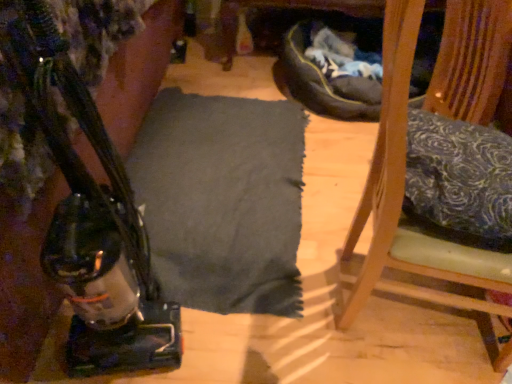
Question: Could wooden chair at right be considered to be inside blue floral fabric pillow at right?

Choices:
 (A) yes
 (B) no

Answer: (B)

Question: Is blue floral fabric pillow at right at the right side of wooden chair at right?

Choices:
 (A) no
 (B) yes

Answer: (A)

Question: Are blue floral fabric pillow at right and wooden chair at right far apart?

Choices:
 (A) no
 (B) yes

Answer: (A)

Question: Is blue floral fabric pillow at right turned away from wooden chair at right?

Choices:
 (A) no
 (B) yes

Answer: (B)

Question: From the image's perspective, is blue floral fabric pillow at right under wooden chair at right?

Choices:
 (A) yes
 (B) no

Answer: (B)

Question: From a real-world perspective, is blue floral fabric pillow at right under wooden chair at right?

Choices:
 (A) yes
 (B) no

Answer: (B)

Question: Is blue floral fabric pillow at right located outside matte black vacuum cleaner at left?

Choices:
 (A) no
 (B) yes

Answer: (B)

Question: From a real-world perspective, is blue floral fabric pillow at right located higher than matte black vacuum cleaner at left?

Choices:
 (A) yes
 (B) no

Answer: (A)

Question: From the image's perspective, is blue floral fabric pillow at right located beneath matte black vacuum cleaner at left?

Choices:
 (A) yes
 (B) no

Answer: (B)

Question: Is blue floral fabric pillow at right wider than matte black vacuum cleaner at left?

Choices:
 (A) yes
 (B) no

Answer: (A)

Question: Is blue floral fabric pillow at right positioned far away from matte black vacuum cleaner at left?

Choices:
 (A) yes
 (B) no

Answer: (B)

Question: Is blue floral fabric pillow at right smaller than matte black vacuum cleaner at left?

Choices:
 (A) no
 (B) yes

Answer: (B)

Question: Is the position of matte black vacuum cleaner at left more distant than that of blue floral fabric pillow at right?

Choices:
 (A) yes
 (B) no

Answer: (B)